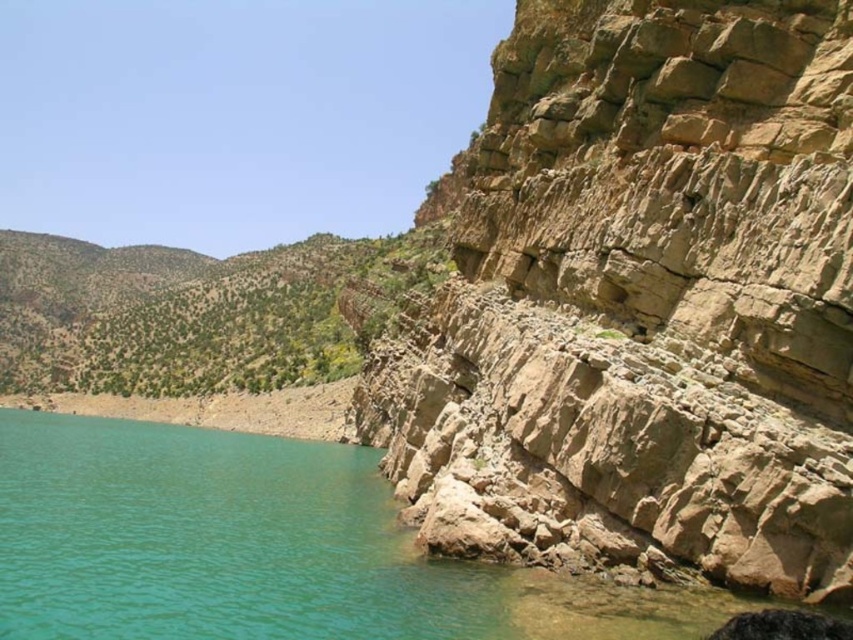
Can you confirm if brown rough rock at right is thinner than turquoise water at lower left?

Yes.

Which is behind, point (691, 106) or point (210, 632)?

Positioned behind is point (691, 106).

In order to click on brown rough rock at right in this screenshot , I will do `click(643, 304)`.